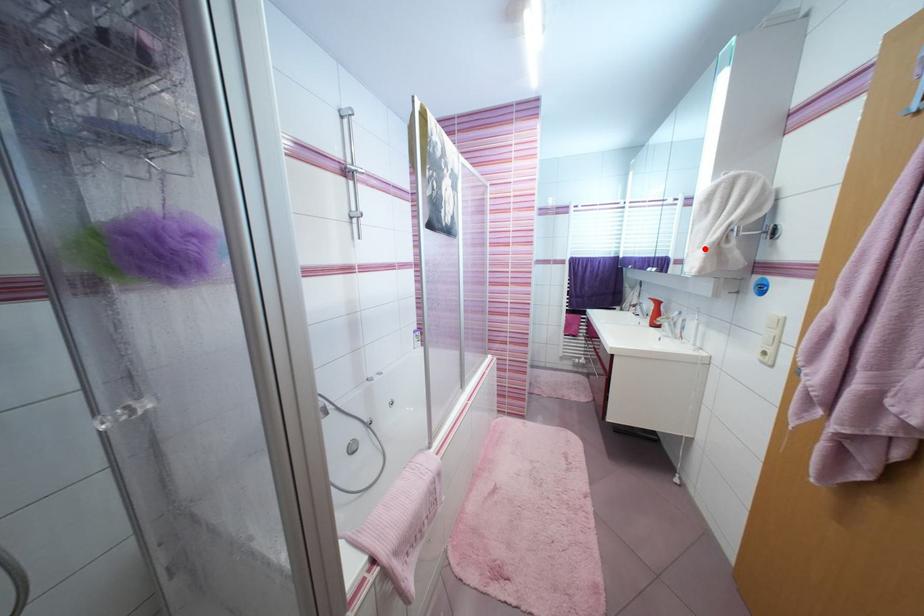
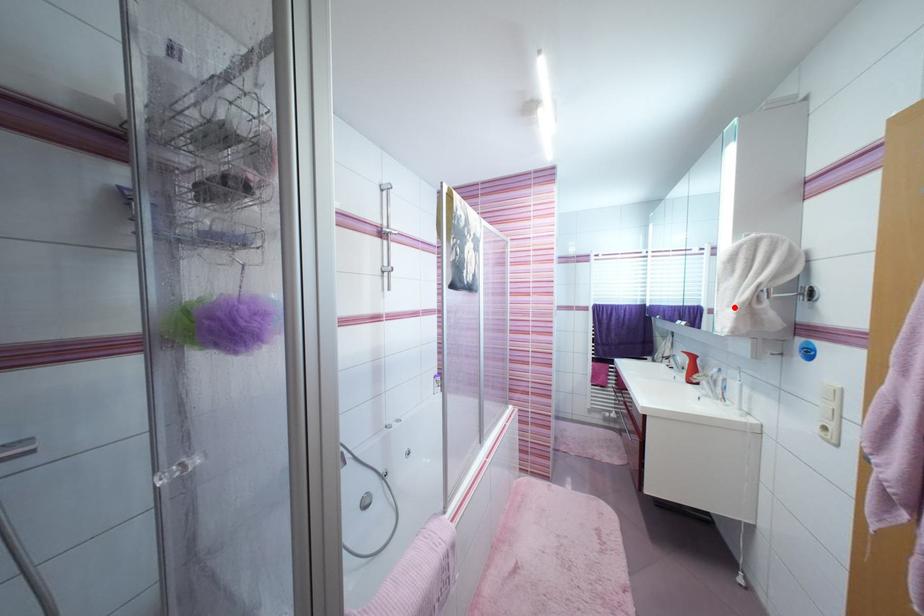
I am providing you with two images of the same scene from different viewpoints. A red point is marked on the first image and another point is marked on the second image. Do the highlighted points in image1 and image2 indicate the same real-world spot?

Yes